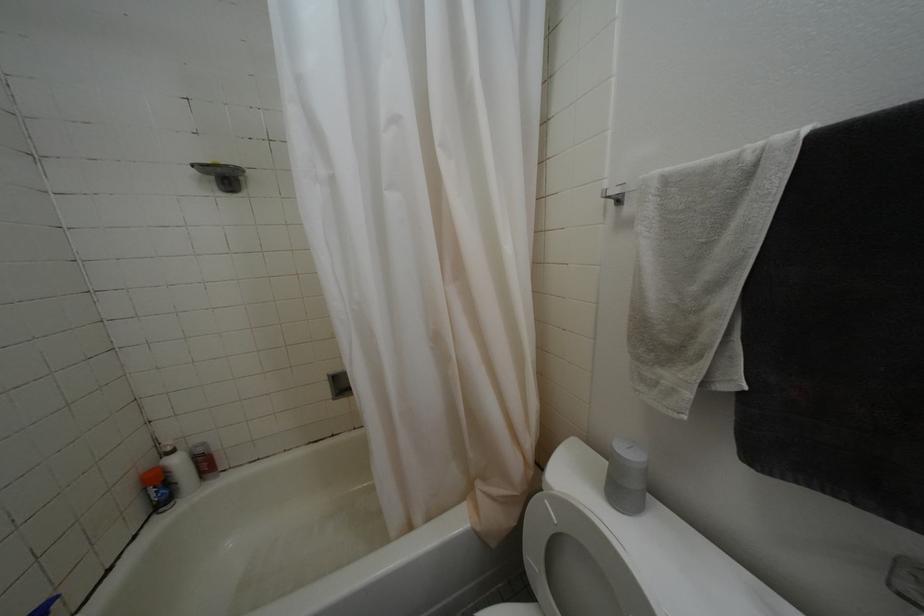
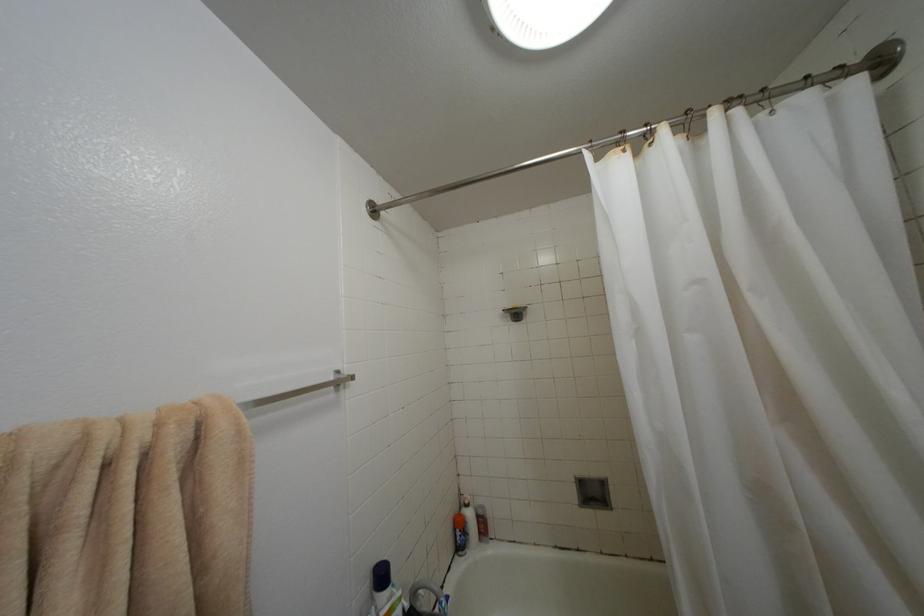
Based on the continuous images, in which direction is the camera rotating?

The camera's rotation is toward left-up.